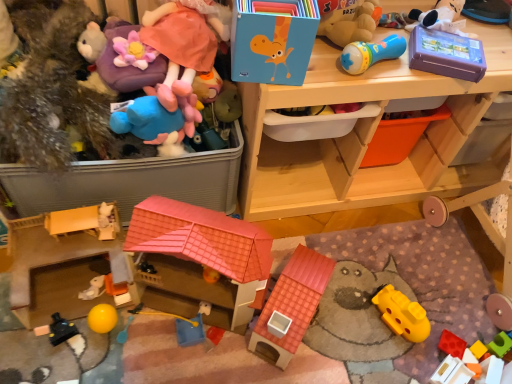
Locate an element on the screen. free space between yellow rubber ball at lower left, the fourth toy from the left, and blue plastic toy at center, the 8th toy viewed from the left is located at coordinates (144, 333).